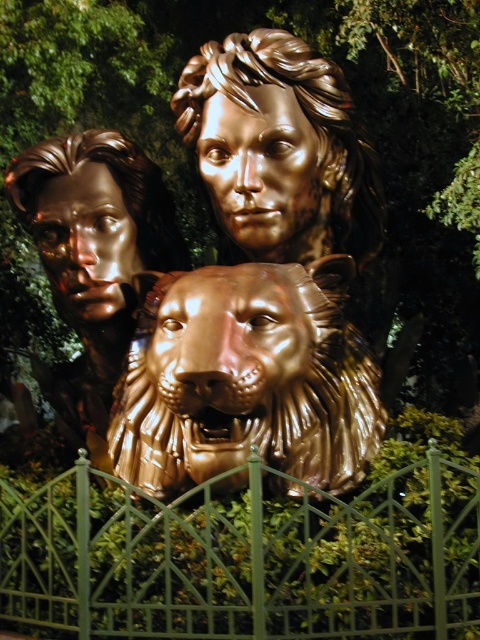
Question: Which object appears farthest from the camera in this image?

Choices:
 (A) shiny gold lion at center
 (B) shiny gold head at center
 (C) shiny bronze lion head at center
 (D) green metal fence at center

Answer: (B)

Question: Can you confirm if green metal fence at center is bigger than shiny gold lion at center?

Choices:
 (A) no
 (B) yes

Answer: (B)

Question: Is shiny bronze lion head at center to the right of shiny gold lion at center from the viewer's perspective?

Choices:
 (A) no
 (B) yes

Answer: (A)

Question: Is green metal fence at center closer to the viewer compared to gold polished head at center?

Choices:
 (A) no
 (B) yes

Answer: (B)

Question: Which point is closer to the camera?

Choices:
 (A) shiny bronze lion head at center
 (B) shiny gold lion at center

Answer: (B)

Question: Which point is closer to the camera?

Choices:
 (A) gold polished head at center
 (B) green metal fence at center
 (C) shiny bronze lion head at center

Answer: (B)